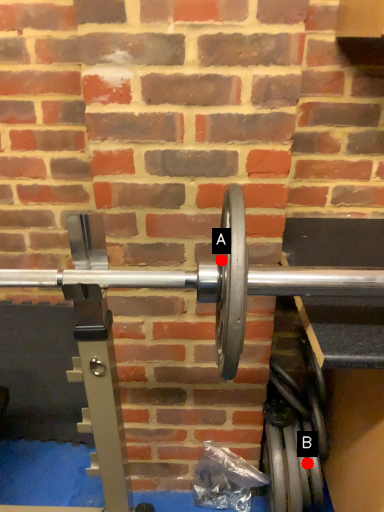
Question: Two points are circled on the image, labeled by A and B beside each circle. Which point is closer to the camera taking this photo?

Choices:
 (A) A is closer
 (B) B is closer

Answer: (A)